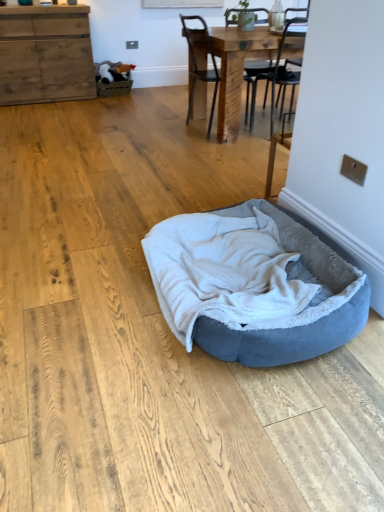
Question: Is point (210, 124) closer or farther from the camera than point (241, 236)?

Choices:
 (A) closer
 (B) farther

Answer: (B)

Question: Looking at their shapes, would you say black metal chair at upper center is wider or thinner than soft gray plush dog bed at center?

Choices:
 (A) wide
 (B) thin

Answer: (B)

Question: Estimate the real-world distances between objects in this image. Which object is farther from the wooden cabinet at upper left?

Choices:
 (A) wooden table at center
 (B) black metal chair at upper center
 (C) soft gray plush dog bed at center

Answer: (C)

Question: Considering the real-world distances, which object is closest to the soft gray plush dog bed at center?

Choices:
 (A) wooden table at center
 (B) black metal chair at upper center
 (C) wooden cabinet at upper left

Answer: (A)